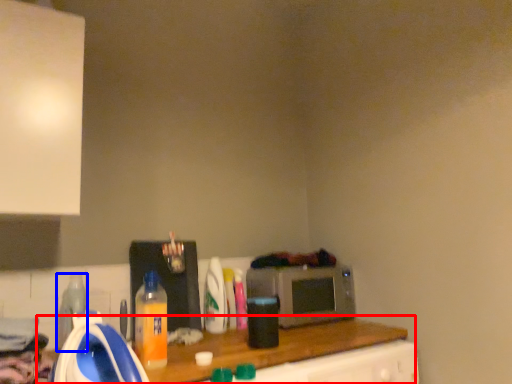
Question: Which object appears closest to the camera in this image, counter top (highlighted by a red box) or bottle (highlighted by a blue box)?

Choices:
 (A) counter top
 (B) bottle

Answer: (A)